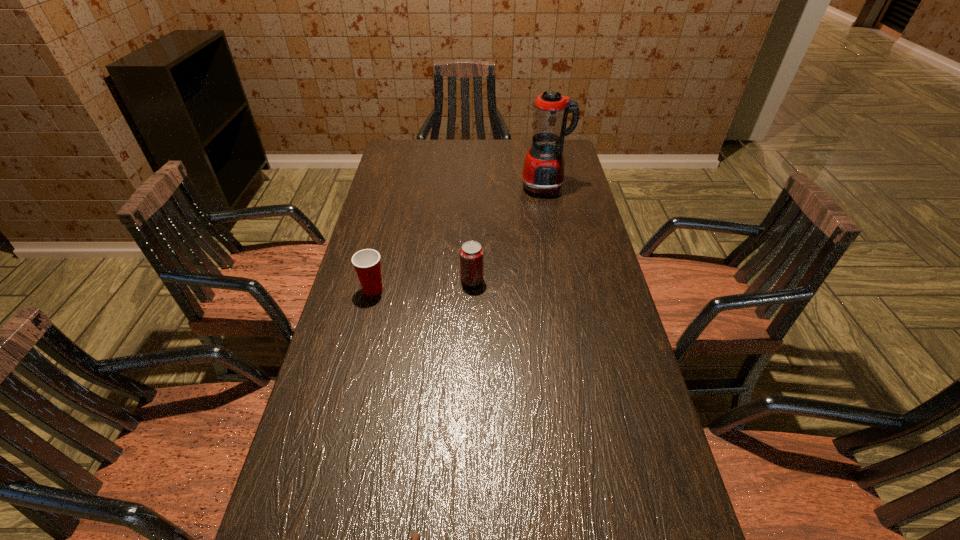
In the image, there is a desktop. At what (x,y) coordinates should I click in order to perform the action: click on vacant region at the left edge. Please return your answer as a coordinate pair (x, y). Looking at the image, I should click on (300, 514).

At what (x,y) coordinates should I click in order to perform the action: click on free space at the right edge. Please return your answer as a coordinate pair (x, y). The image size is (960, 540). Looking at the image, I should click on (602, 362).

At what (x,y) coordinates should I click in order to perform the action: click on vacant area at the far left corner. Please return your answer as a coordinate pair (x, y). The height and width of the screenshot is (540, 960). Looking at the image, I should click on (388, 147).

The width and height of the screenshot is (960, 540). In order to click on free spot between the tallest object and the third object from left to right in this screenshot , I will do `click(508, 234)`.

I want to click on empty space that is in between the food processor and the leftmost object, so point(459,238).

Image resolution: width=960 pixels, height=540 pixels. I want to click on vacant space that is in between the food processor and the soda can, so click(x=508, y=234).

Select which object is the closest to the leftmost object. Please provide its 2D coordinates. Your answer should be formatted as a tuple, i.e. [(x, y)], where the tuple contains the x and y coordinates of a point satisfying the conditions above.

[(471, 253)]

Locate an element on the screen. The image size is (960, 540). object that is the third closest to the shortest object is located at coordinates (543, 170).

Locate an element on the screen. vacant position in the image that satisfies the following two spatial constraints: 1. on the controls of the food processor; 2. on the logo side of the soda can is located at coordinates (563, 280).